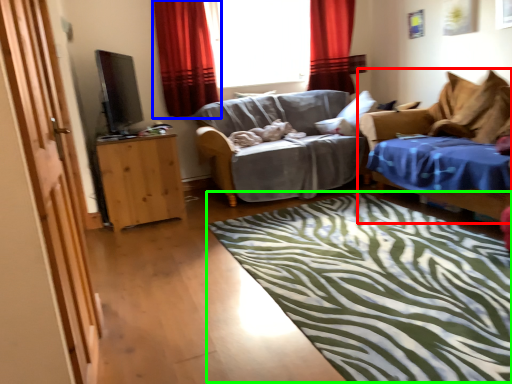
Question: Considering the real-world distances, which object is farthest from studio couch (highlighted by a red box)? curtain (highlighted by a blue box) or mat (highlighted by a green box)?

Choices:
 (A) curtain
 (B) mat

Answer: (A)